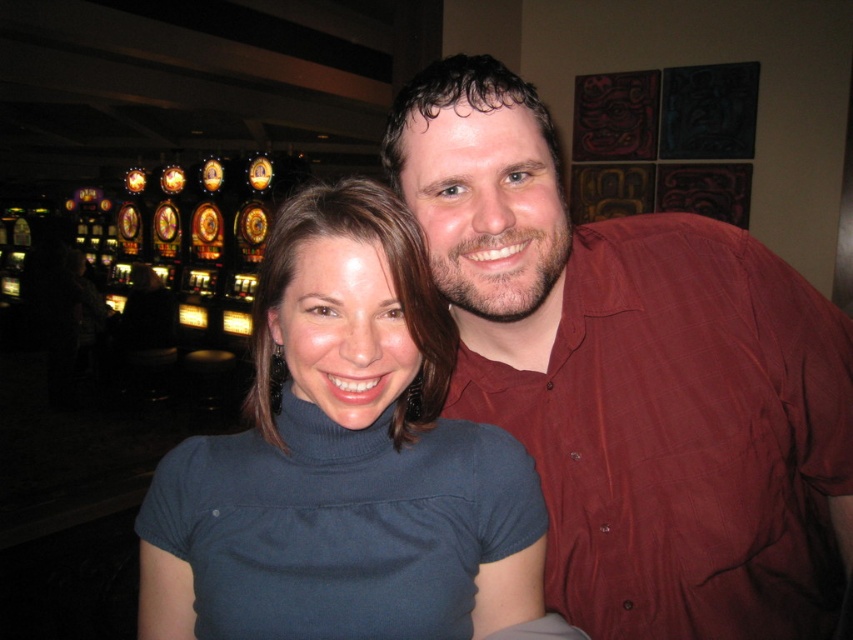
Consider the image. You are a photographer trying to capture a group photo of the matte red shirt at upper right and the dark blue turtleneck at center. The camera you are using has a minimum focusing distance of 8 inches. Can you take a clear photo of both subjects without moving them?

The distance between the matte red shirt at upper right and the dark blue turtleneck at center is 7.58 inches, which is less than the camera minimum focusing distance of 8 inches. Therefore, you cannot take a clear photo of both subjects without moving them closer together.

You are a photographer trying to decide which subject to focus on in the image. The matte red shirt at upper right and the dark blue turtleneck at center are both in the frame. Which subject has a wider width?

The matte red shirt at upper right has a larger width than the dark blue turtleneck at center according to the description.